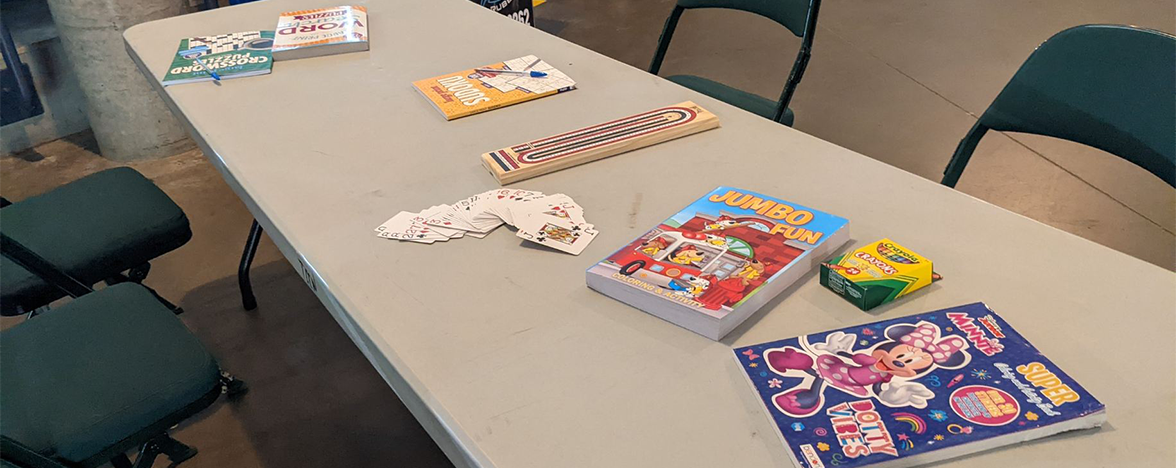
Where is `book`? The height and width of the screenshot is (468, 1176). book is located at coordinates [x=683, y=278], [x=880, y=356], [x=474, y=82], [x=283, y=21], [x=232, y=49].